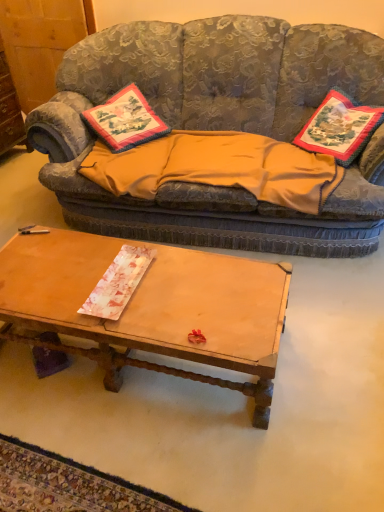
The height and width of the screenshot is (512, 384). Find the location of `vacant space in front of wooden coffee table at center`. vacant space in front of wooden coffee table at center is located at coordinates (145, 439).